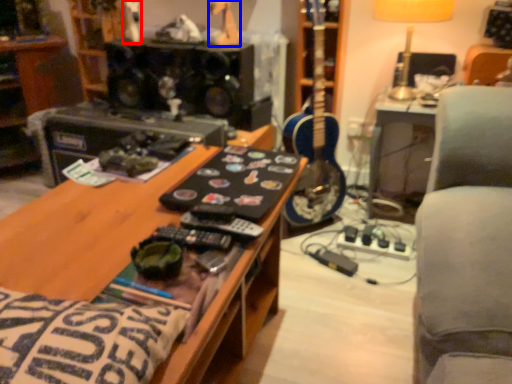
Question: Which point is further to the camera, toy (highlighted by a red box) or toy (highlighted by a blue box)?

Choices:
 (A) toy
 (B) toy

Answer: (A)